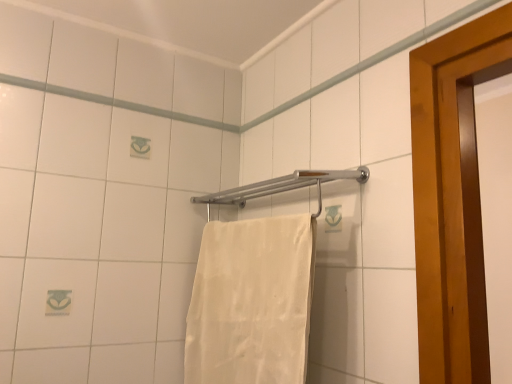
Measure the distance between point (318,180) and camera.

Point (318,180) is 3.97 feet from camera.

At what (x,y) coordinates should I click in order to perform the action: click on silver metallic towel bar at center. Please return your answer as a coordinate pair (x, y). The height and width of the screenshot is (384, 512). Looking at the image, I should click on (282, 187).

Image resolution: width=512 pixels, height=384 pixels. What do you see at coordinates (282, 187) in the screenshot?
I see `silver metallic towel bar at center` at bounding box center [282, 187].

What is the approximate width of white cotton towel at center?

It is 13.74 centimeters.

The image size is (512, 384). What do you see at coordinates (251, 302) in the screenshot?
I see `white cotton towel at center` at bounding box center [251, 302].

The height and width of the screenshot is (384, 512). What are the coordinates of `white cotton towel at center` in the screenshot? It's located at (251, 302).

Find the location of a particular element. The image size is (512, 384). silver metallic towel bar at center is located at coordinates (282, 187).

Visually, is white cotton towel at center positioned to the left or to the right of silver metallic towel bar at center?

Based on their positions, white cotton towel at center is located to the left of silver metallic towel bar at center.

Which object is more forward, white cotton towel at center or silver metallic towel bar at center?

white cotton towel at center.

Which point is more distant from viewer, (236, 365) or (319, 193)?

The point (319, 193) is farther from the camera.

From the image's perspective, is white cotton towel at center positioned above or below silver metallic towel bar at center?

Clearly, from the image's perspective, white cotton towel at center is below silver metallic towel bar at center.

From a real-world perspective, who is located higher, white cotton towel at center or silver metallic towel bar at center?

silver metallic towel bar at center, from a real-world perspective.

In the scene shown: Can you confirm if white cotton towel at center is wider than silver metallic towel bar at center?

Incorrect, the width of white cotton towel at center does not surpass that of silver metallic towel bar at center.

Considering the sizes of objects white cotton towel at center and silver metallic towel bar at center in the image provided, who is shorter, white cotton towel at center or silver metallic towel bar at center?

silver metallic towel bar at center.

Is white cotton towel at center smaller than silver metallic towel bar at center?

Incorrect, white cotton towel at center is not smaller in size than silver metallic towel bar at center.

Is white cotton towel at center not within silver metallic towel bar at center?

white cotton towel at center lies outside silver metallic towel bar at center's area.

Can you see white cotton towel at center touching silver metallic towel bar at center?

white cotton towel at center is not next to silver metallic towel bar at center, and they're not touching.

Is white cotton towel at center aimed at silver metallic towel bar at center?

No, white cotton towel at center is not oriented towards silver metallic towel bar at center.

How different are the orientations of white cotton towel at center and silver metallic towel bar at center in degrees?

white cotton towel at center and silver metallic towel bar at center are facing 7.8e-05 degrees away from each other.

How far apart are white cotton towel at center and silver metallic towel bar at center?

The distance of white cotton towel at center from silver metallic towel bar at center is 30.82 centimeters.

Where is `towel located in front of the silver metallic towel bar at center`? The width and height of the screenshot is (512, 384). towel located in front of the silver metallic towel bar at center is located at coordinates (251, 302).

Considering the relative positions of silver metallic towel bar at center and white cotton towel at center in the image provided, is silver metallic towel bar at center to the right of white cotton towel at center from the viewer's perspective?

Yes, silver metallic towel bar at center is to the right of white cotton towel at center.

From the picture: Which object is further away from the camera, silver metallic towel bar at center or white cotton towel at center?

silver metallic towel bar at center is more distant.

Is point (283, 178) closer or farther from the camera than point (259, 336)?

Point (283, 178) appears to be farther away from the viewer than point (259, 336).

From the image's perspective, which is below, silver metallic towel bar at center or white cotton towel at center?

white cotton towel at center.

From a real-world perspective, which object rests below the other?

white cotton towel at center is physically lower.

Can you confirm if silver metallic towel bar at center is wider than white cotton towel at center?

Yes, silver metallic towel bar at center is wider than white cotton towel at center.

Considering the sizes of silver metallic towel bar at center and white cotton towel at center in the image, is silver metallic towel bar at center taller or shorter than white cotton towel at center?

Clearly, silver metallic towel bar at center is shorter compared to white cotton towel at center.

Considering the sizes of objects silver metallic towel bar at center and white cotton towel at center in the image provided, who is smaller, silver metallic towel bar at center or white cotton towel at center?

With smaller size is silver metallic towel bar at center.

Would you say silver metallic towel bar at center is inside or outside white cotton towel at center?

The correct answer is: outside.

Is silver metallic towel bar at center touching white cotton towel at center?

silver metallic towel bar at center and white cotton towel at center are not in contact.

Is silver metallic towel bar at center oriented away from white cotton towel at center?

No, white cotton towel at center is not at the back of silver metallic towel bar at center.

Find the location of `towel bar positioned vertically above the white cotton towel at center (from a real-world perspective)`. towel bar positioned vertically above the white cotton towel at center (from a real-world perspective) is located at coordinates (x=282, y=187).

You are a GUI agent. You are given a task and a screenshot of the screen. Output one action in this format:
    pyautogui.click(x=<x>, y=<y>)
    Task: Click on the towel in front of the silver metallic towel bar at center
    The height and width of the screenshot is (384, 512).
    Given the screenshot: What is the action you would take?
    pyautogui.click(x=251, y=302)

The width and height of the screenshot is (512, 384). Find the location of `towel bar located behind the white cotton towel at center`. towel bar located behind the white cotton towel at center is located at coordinates [282, 187].